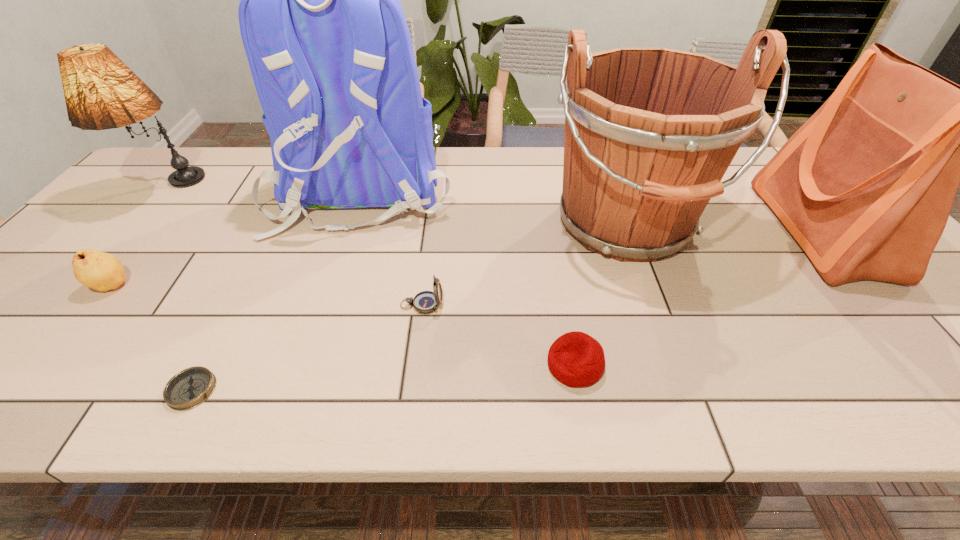
You are a GUI agent. You are given a task and a screenshot of the screen. Output one action in this format:
    pyautogui.click(x=<x>, y=<y>)
    Task: Click on the free location located on the back of the backpack
    This screenshot has height=540, width=960.
    Given the screenshot: What is the action you would take?
    pyautogui.click(x=321, y=321)

Find the location of a particular element. This screenshot has width=960, height=540. vacant position located with the handle on the side of the bucket is located at coordinates (680, 370).

The height and width of the screenshot is (540, 960). In order to click on blank area located 0.050m on the front pocket of the rightmost object in this screenshot , I will do `click(756, 231)`.

The width and height of the screenshot is (960, 540). What are the coordinates of `vacant space located 0.220m on the front pocket of the rightmost object` in the screenshot? It's located at (693, 231).

I want to click on vacant space located 0.050m on the front pocket of the rightmost object, so click(x=756, y=231).

Where is `vacant space located 0.240m on the front-facing side of the lampshade`? This screenshot has height=540, width=960. vacant space located 0.240m on the front-facing side of the lampshade is located at coordinates (94, 278).

Find the location of a particular element. The image size is (960, 540). free space located 0.330m on the right of the pear is located at coordinates (270, 286).

Locate an element on the screen. free space located 0.400m on the face of the third shortest object is located at coordinates (621, 305).

Locate an element on the screen. The width and height of the screenshot is (960, 540). free space located 0.350m on the seat area of the seventh tallest object is located at coordinates (372, 364).

Find the location of a particular element. This screenshot has width=960, height=540. vacant space located 0.350m on the seat area of the seventh tallest object is located at coordinates (x=372, y=364).